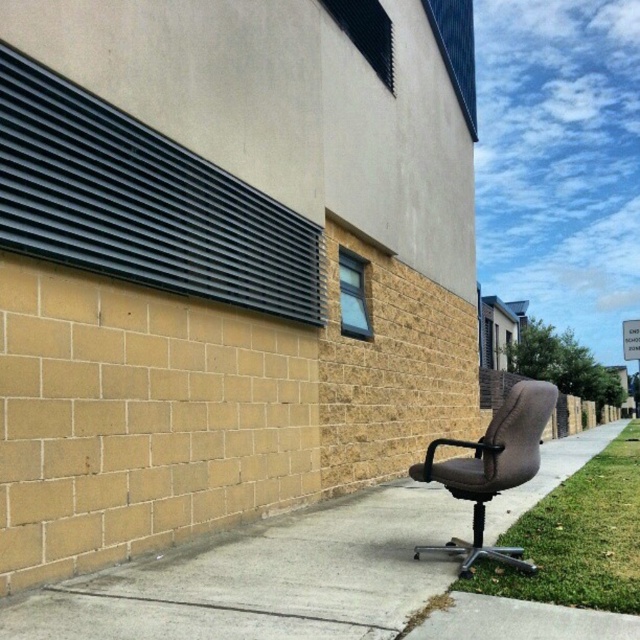
Is point (288, 556) farther from camera compared to point (572, 602)?

Yes.

Can you confirm if brown leather chair at right is thinner than green grass at lower right?

In fact, brown leather chair at right might be wider than green grass at lower right.

Between point (467, 518) and point (547, 554), which one is positioned behind?

The point (467, 518) is behind.

Find the location of a particular element. brown leather chair at right is located at coordinates (266, 579).

Can you confirm if brown leather chair at right is taller than brown leather office chair at lower right?

In fact, brown leather chair at right may be shorter than brown leather office chair at lower right.

Between brown leather chair at right and brown leather office chair at lower right, which one has less height?

brown leather chair at right is shorter.

You are a GUI agent. You are given a task and a screenshot of the screen. Output one action in this format:
    pyautogui.click(x=<x>, y=<y>)
    Task: Click on the brown leather chair at right
    
    Given the screenshot: What is the action you would take?
    pyautogui.click(x=266, y=579)

In order to click on brown leather chair at right in this screenshot , I will do `click(266, 579)`.

Looking at this image, which is more to the left, green grass at lower right or brown leather office chair at lower right?

brown leather office chair at lower right

Can you confirm if green grass at lower right is shorter than brown leather office chair at lower right?

Yes, green grass at lower right is shorter than brown leather office chair at lower right.

Where is `green grass at lower right`? green grass at lower right is located at coordinates point(577,538).

At what (x,y) coordinates should I click in order to perform the action: click on green grass at lower right. Please return your answer as a coordinate pair (x, y). This screenshot has width=640, height=640. Looking at the image, I should click on point(577,538).